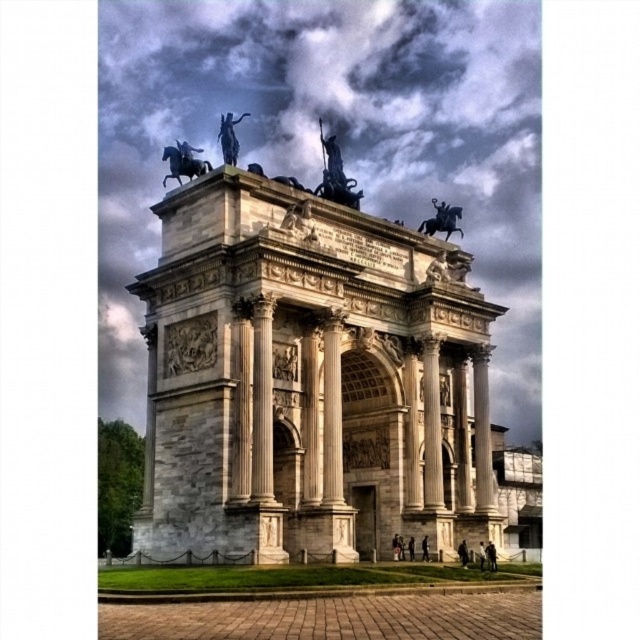
What do you see at coordinates (182, 161) in the screenshot?
I see `shiny black horse at upper center` at bounding box center [182, 161].

Where is `shiny black horse at upper center`? shiny black horse at upper center is located at coordinates [182, 161].

Is white marble arch at center thinner than polished bronze statue at center?

No, white marble arch at center is not thinner than polished bronze statue at center.

Between point (230, 392) and point (332, 145), which one is positioned behind?

The point (332, 145) is more distant.

Is point (234, 518) closer to viewer compared to point (332, 136)?

Yes.

Find the location of a particular element. white marble arch at center is located at coordinates (308, 380).

From the picture: Is white marble arch at center below polished bronze horseman at upper right?

Indeed, white marble arch at center is positioned under polished bronze horseman at upper right.

From the picture: Is the position of white marble arch at center less distant than that of polished bronze horseman at upper right?

Yes, white marble arch at center is in front of polished bronze horseman at upper right.

I want to click on white marble arch at center, so click(308, 380).